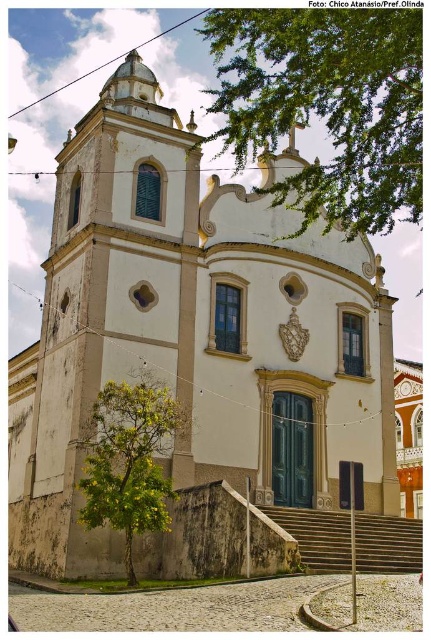
Question: Which object is positioned farthest from the stone steps at center?

Choices:
 (A) green leafy tree at upper center
 (B) green leafy tree at lower left

Answer: (A)

Question: Can you confirm if green leafy tree at lower left is positioned to the left of stone steps at center?

Choices:
 (A) no
 (B) yes

Answer: (B)

Question: Which object is the farthest from the green leafy tree at lower left?

Choices:
 (A) green leafy tree at upper center
 (B) stone steps at center

Answer: (A)

Question: Which object appears farthest from the camera in this image?

Choices:
 (A) stone steps at center
 (B) green leafy tree at lower left
 (C) green leafy tree at upper center

Answer: (A)

Question: Is green leafy tree at upper center below green leafy tree at lower left?

Choices:
 (A) yes
 (B) no

Answer: (B)

Question: Does green leafy tree at lower left appear over stone steps at center?

Choices:
 (A) no
 (B) yes

Answer: (B)